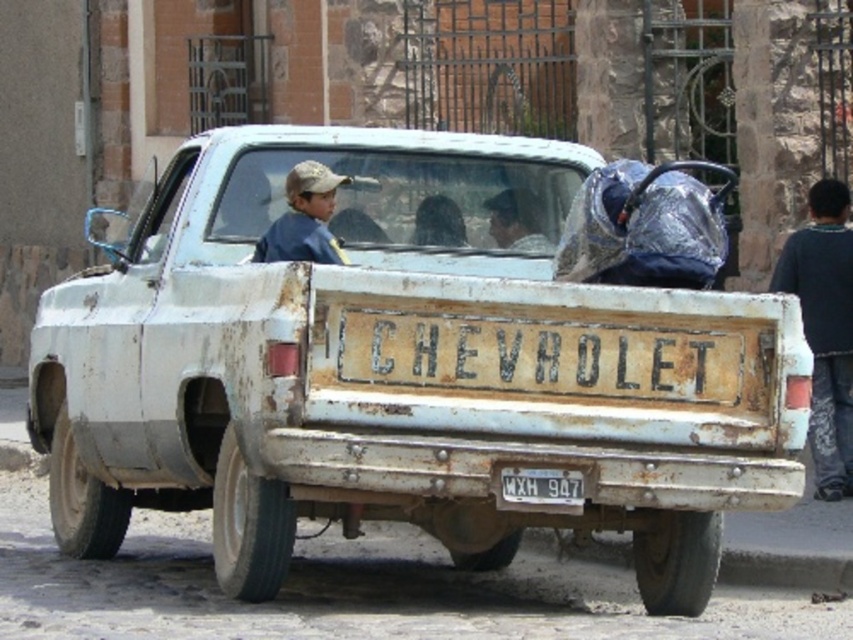
Question: Does rusty white truck at center appear on the left side of dark blue fabric at center?

Choices:
 (A) no
 (B) yes

Answer: (B)

Question: Does dark blue fabric at center have a smaller size compared to white matte license plate at center?

Choices:
 (A) no
 (B) yes

Answer: (A)

Question: Which point is closer to the camera taking this photo?

Choices:
 (A) (201, 157)
 (B) (506, 488)

Answer: (B)

Question: Estimate the real-world distances between objects in this image. Which object is closer to the dark blue fabric at center?

Choices:
 (A) dark blue fabric at right
 (B) white matte license plate at center

Answer: (B)

Question: Which point appears farthest from the camera in this image?

Choices:
 (A) (299, 467)
 (B) (833, 307)
 (C) (486, 204)
 (D) (500, 484)

Answer: (B)

Question: Considering the relative positions of dark blue fabric at center and white matte license plate at center in the image provided, where is dark blue fabric at center located with respect to white matte license plate at center?

Choices:
 (A) right
 (B) left

Answer: (B)